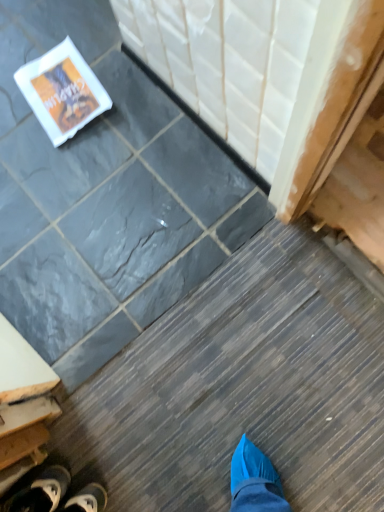
What do you see at coordinates (41, 492) in the screenshot? Image resolution: width=384 pixels, height=512 pixels. I see `black canvas shoe at lower left` at bounding box center [41, 492].

At what (x,y) coordinates should I click in order to perform the action: click on black canvas shoe at lower left. Please return your answer as a coordinate pair (x, y). This screenshot has height=512, width=384. Looking at the image, I should click on (41, 492).

Identify the location of black canvas shoe at lower left. The width and height of the screenshot is (384, 512). (41, 492).